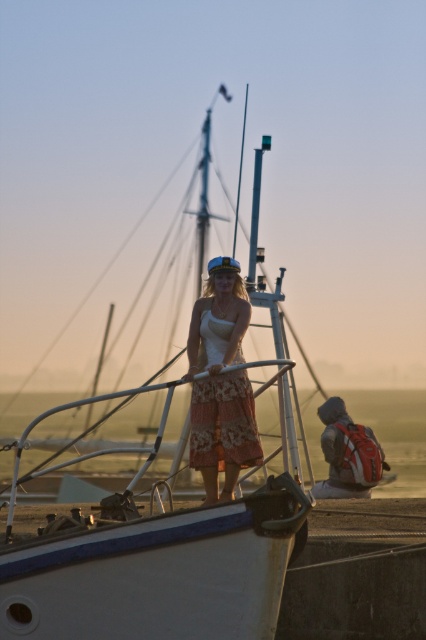
Question: Does white matte boat at center have a lesser width compared to smooth white mast at center?

Choices:
 (A) no
 (B) yes

Answer: (A)

Question: Does white matte boat at center appear on the left side of smooth white mast at center?

Choices:
 (A) no
 (B) yes

Answer: (B)

Question: Which object is closer to the camera taking this photo?

Choices:
 (A) matte white dress at center
 (B) red backpack at lower right

Answer: (A)

Question: Which point appears closest to the camera in this image?

Choices:
 (A) (360, 428)
 (B) (230, 516)
 (C) (242, 140)
 (D) (218, 403)

Answer: (B)

Question: Based on their relative distances, which object is nearer to the smooth white mast at center?

Choices:
 (A) white matte boat at center
 (B) matte white dress at center
 (C) red backpack at lower right

Answer: (C)

Question: Considering the relative positions of red backpack at lower right and smooth white mast at center in the image provided, where is red backpack at lower right located with respect to smooth white mast at center?

Choices:
 (A) below
 (B) above

Answer: (A)